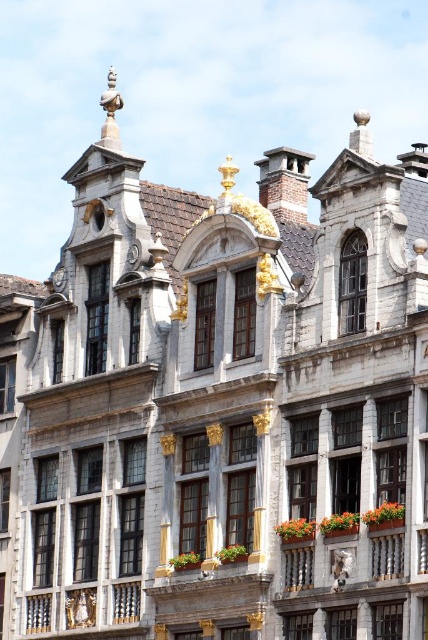
What do you see at coordinates (339, 529) in the screenshot? I see `orange fabric flower box at center` at bounding box center [339, 529].

At what (x,y) coordinates should I click in order to perform the action: click on orange fabric flower box at center. Please return your answer as a coordinate pair (x, y). Looking at the image, I should click on (339, 529).